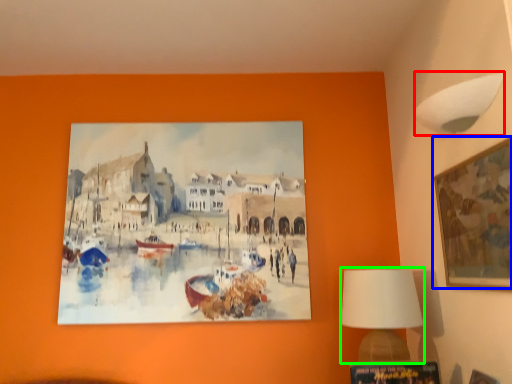
Question: Which object is positioned closest to lamp (highlighted by a red box)? Select from picture frame (highlighted by a blue box) and table lamp (highlighted by a green box).

Choices:
 (A) picture frame
 (B) table lamp

Answer: (A)